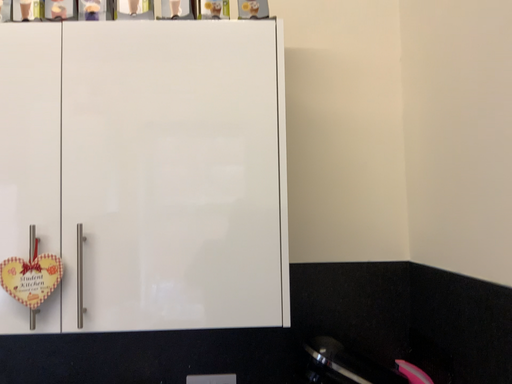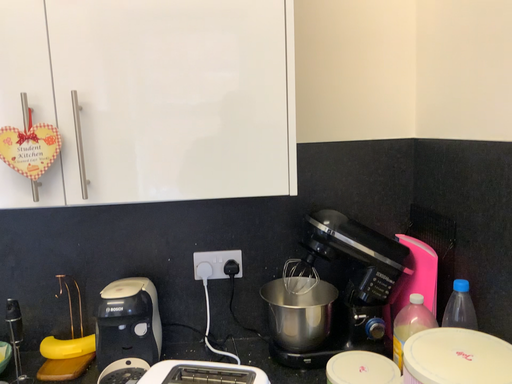
Question: How did the camera likely rotate when shooting the video?

Choices:
 (A) rotated upward
 (B) rotated downward

Answer: (B)